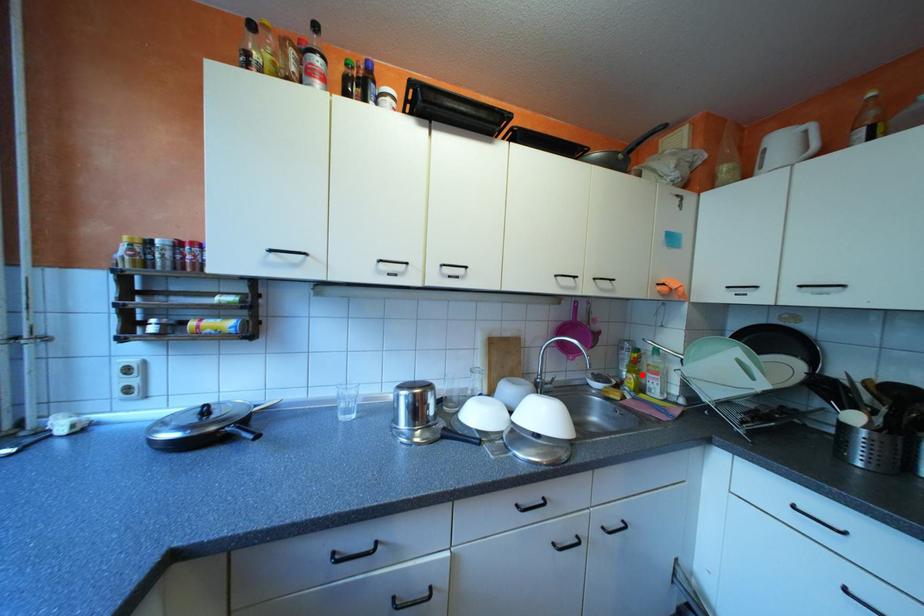
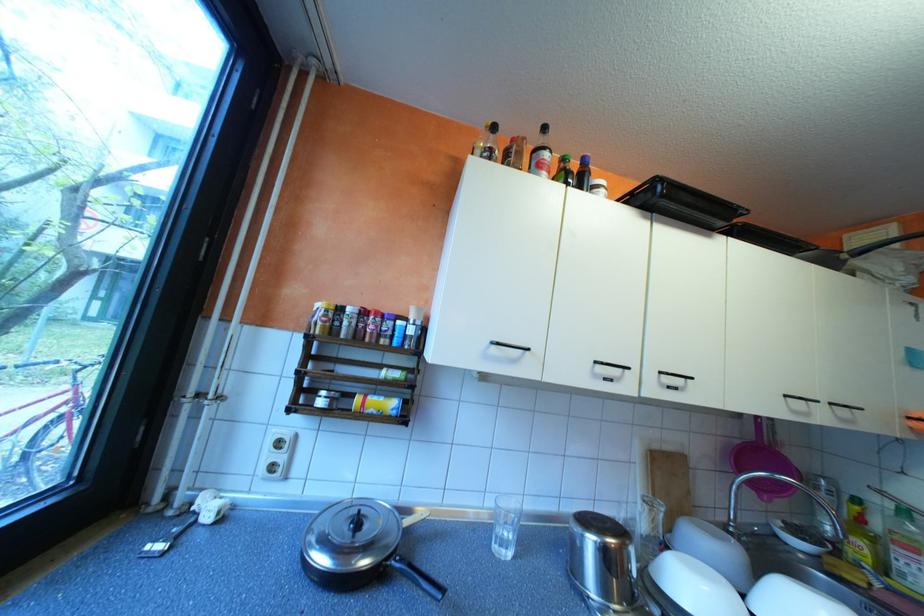
Locate, in the second image, the point that corresponds to the highlighted location in the first image.

(871, 541)